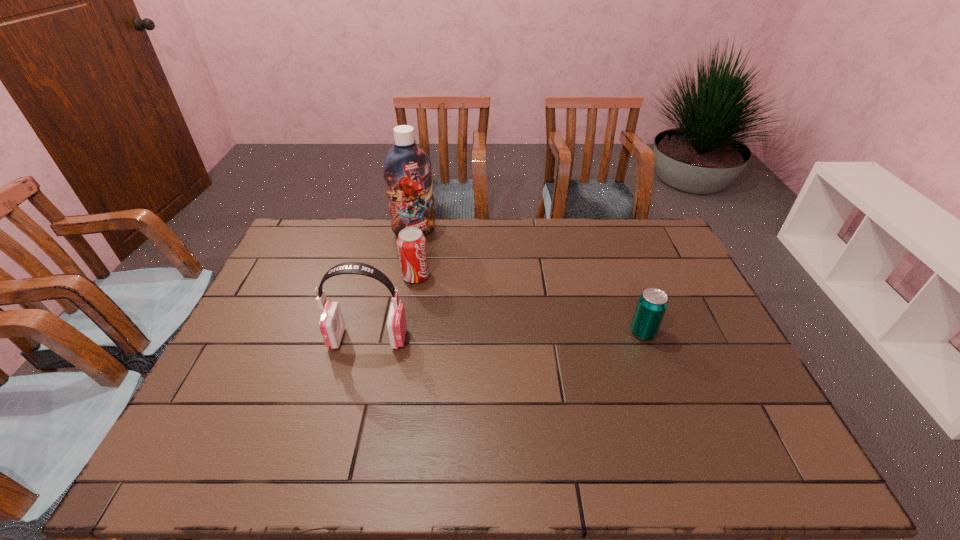
This screenshot has width=960, height=540. Identify the location of vacant spot on the desktop that is between the third shortest object and the beer can and is positioned on the front label of the farthest object. (498, 336).

This screenshot has width=960, height=540. Find the location of `vacant space on the desktop that is between the earphone and the rightmost object and is positioned on the logo side of the second shortest object`. vacant space on the desktop that is between the earphone and the rightmost object and is positioned on the logo side of the second shortest object is located at coordinates (517, 335).